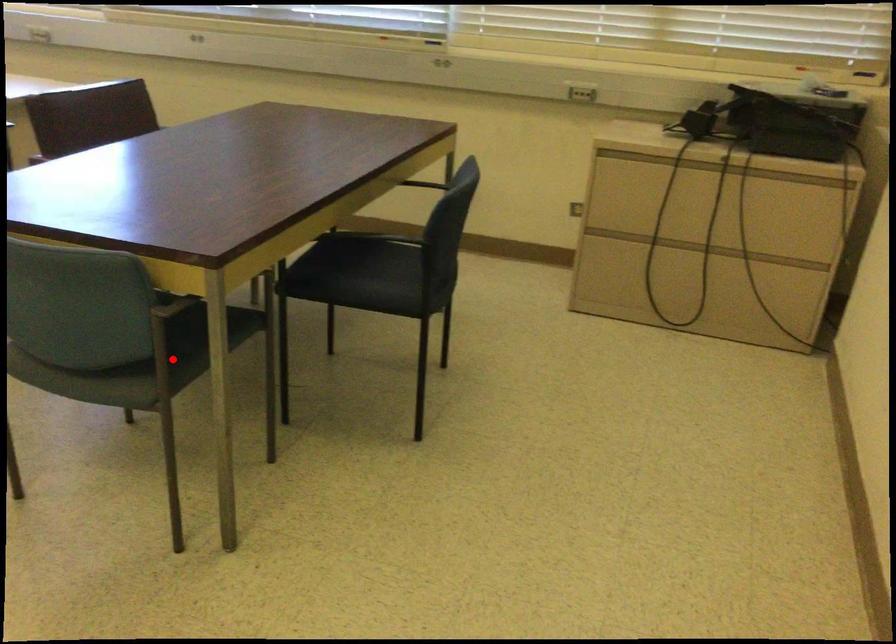
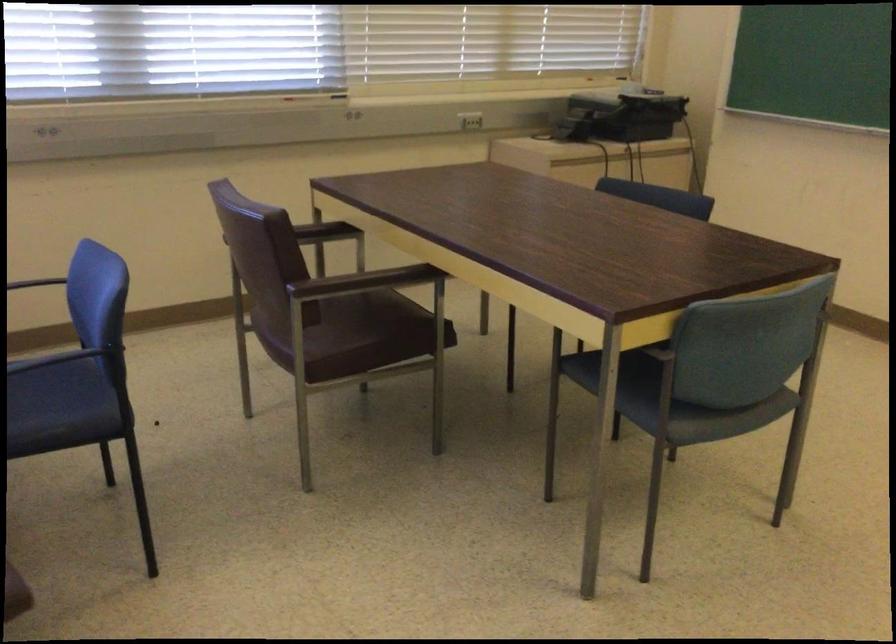
Question: I am providing you with two images of the same scene from different viewpoints. A red point is marked on the first image. At the location where the point appears in image 1, is it still visible in image 2?

Choices:
 (A) Yes
 (B) No

Answer: (B)